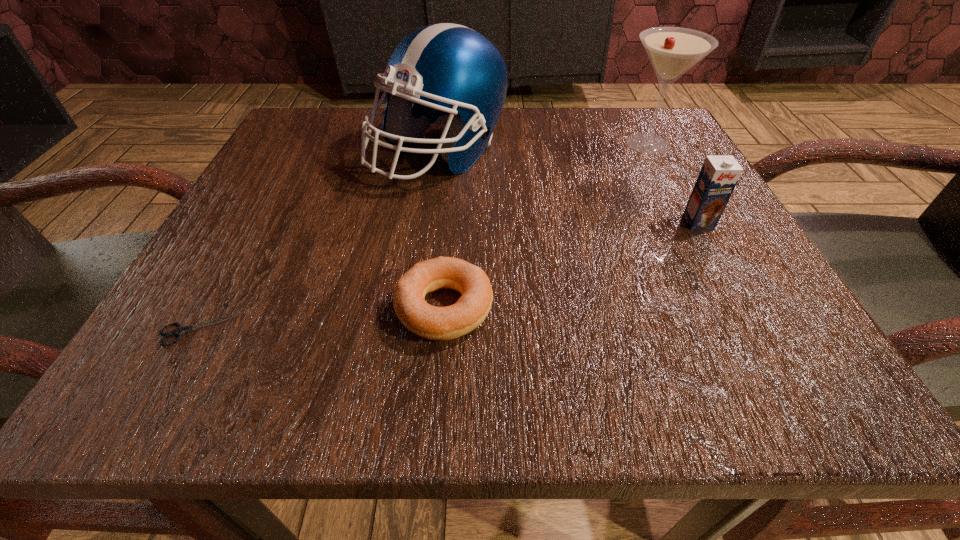
Locate an element on the screen. This screenshot has width=960, height=540. vacant space situated 0.080m on the back of the fourth tallest object is located at coordinates (450, 233).

Identify the location of vacant area located 0.050m on the right of the leftmost object. (280, 329).

Locate an element on the screen. Image resolution: width=960 pixels, height=540 pixels. football helmet situated at the far edge is located at coordinates (452, 75).

This screenshot has width=960, height=540. Identify the location of martini that is positioned at the far edge. (672, 51).

I want to click on bagel that is positioned at the near edge, so pos(430,322).

Identify the location of shears at the near edge. This screenshot has width=960, height=540. (181, 330).

Identify the location of object present at the left edge. tap(181, 330).

I want to click on martini positioned at the right edge, so click(x=672, y=51).

Where is `chocolate milk present at the right edge`? Image resolution: width=960 pixels, height=540 pixels. chocolate milk present at the right edge is located at coordinates (719, 175).

At what (x,y) coordinates should I click in order to perform the action: click on object present at the near left corner. Please return your answer as a coordinate pair (x, y). This screenshot has height=540, width=960. Looking at the image, I should click on (181, 330).